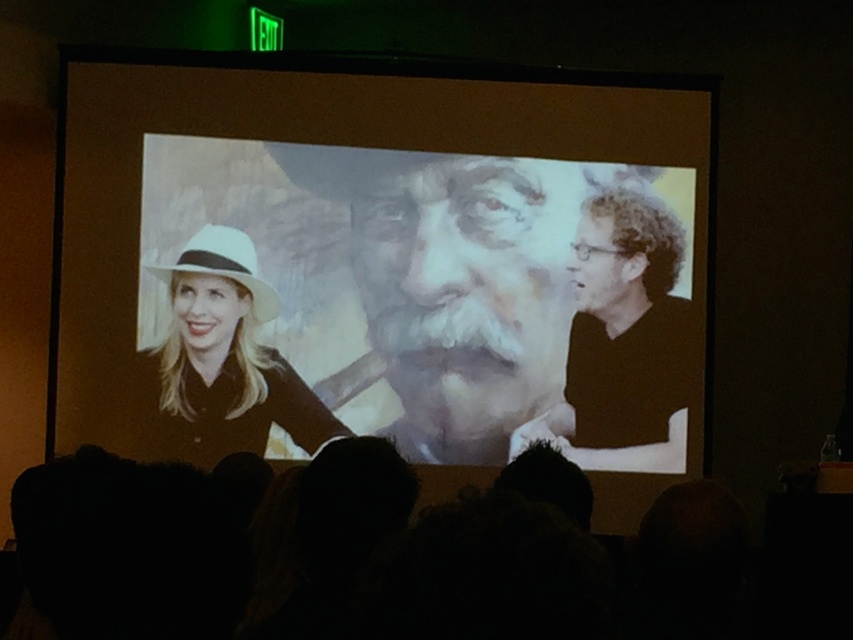
You are an event planner setting up a stage for a presentation. The stage has a matte black screen at center and a smooth black shirt at center. Which object should you adjust if you want to ensure the presenter can be seen clearly by the audience?

The matte black screen at center is larger in size than the smooth black shirt at center, so adjusting the smooth black shirt at center to be positioned in front of the matte black screen at center would ensure the presenter can be seen clearly.

You are an event planner standing at the back of the room. You need to adjust the lighting so that both the matte black screen at center and the white matte hat at left are clearly visible. Which object should you focus on first to ensure visibility?

The matte black screen at center is closer to the viewer than the white matte hat at left, so you should focus on adjusting the lighting for the matte black screen at center first to ensure it is clearly visible before addressing the white matte hat at left.

You are an event coordinator setting up a stage for a presentation. The stage has a matte black screen at center and a white matte hat at left. You need to hang a banner that should be taller than both objects. Based on their sizes, which object should the banner be taller than?

The banner should be taller than the matte black screen at center because it is much taller than the white matte hat at left.